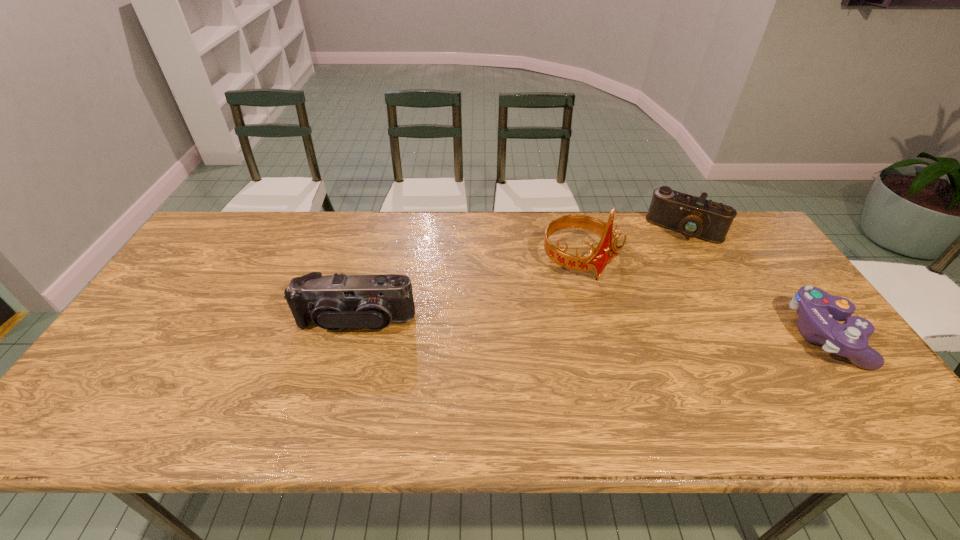
Where is `camera at the right edge`? camera at the right edge is located at coordinates (694, 217).

Locate an element on the screen. The width and height of the screenshot is (960, 540). object that is at the far right corner is located at coordinates coord(694,217).

Image resolution: width=960 pixels, height=540 pixels. I want to click on object that is at the near right corner, so pyautogui.click(x=817, y=310).

Image resolution: width=960 pixels, height=540 pixels. In the image, there is a desktop. What are the coordinates of `vacant space at the far edge` in the screenshot? It's located at (625, 221).

Image resolution: width=960 pixels, height=540 pixels. What are the coordinates of `vacant space at the near edge of the desktop` in the screenshot? It's located at (344, 370).

In the image, there is a desktop. Identify the location of vacant space at the left edge. (205, 275).

Identify the location of vacant region at the right edge of the desktop. Image resolution: width=960 pixels, height=540 pixels. (787, 322).

Where is `vacant area at the near left corner`? vacant area at the near left corner is located at coordinates (101, 387).

Image resolution: width=960 pixels, height=540 pixels. In the image, there is a desktop. Find the location of `free region at the far right corner`. free region at the far right corner is located at coordinates (726, 244).

Image resolution: width=960 pixels, height=540 pixels. I want to click on blank region between the leftmost object and the tiara, so click(x=468, y=291).